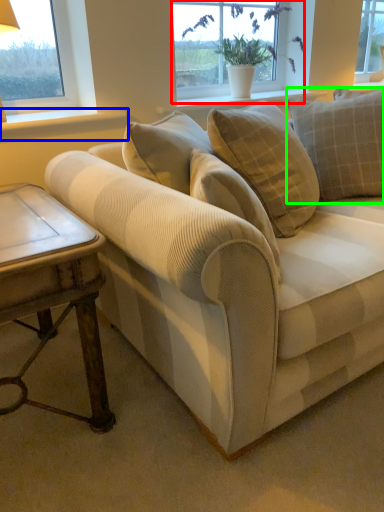
Question: Which object is positioned closest to window (highlighted by a red box)? Select from window sill (highlighted by a blue box) and pillow (highlighted by a green box).

Choices:
 (A) window sill
 (B) pillow

Answer: (B)